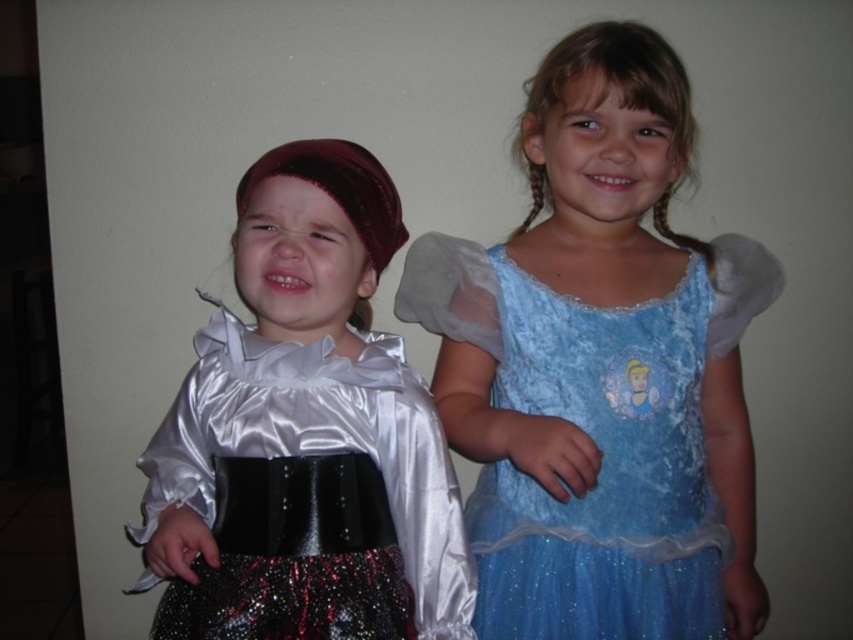
You are a photographer setting up for a photoshoot. You need to position a spotlight so that it illuminates both the blue velvet dress at center and the satin dress at left. Given their positions, where should you place the spotlight to ensure both are equally lit?

The blue velvet dress at center is located above the satin dress at left, so placing the spotlight directly between them at the midpoint would ensure both receive equal lighting.

You are a photographer setting up for a photoshoot. You need to position the blue velvet dress at center and the satin dress at left so that both are visible in the frame. Given their current positions, which dress should you move to ensure both are fully visible?

The blue velvet dress at center is in front of the satin dress at left, so you should move the blue velvet dress at center to allow the satin dress at left to be fully visible.